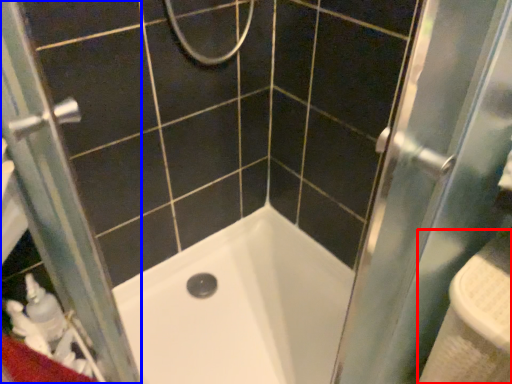
Question: Which object appears closest to the camera in this image, sink (highlighted by a red box) or screen door (highlighted by a blue box)?

Choices:
 (A) sink
 (B) screen door

Answer: (B)